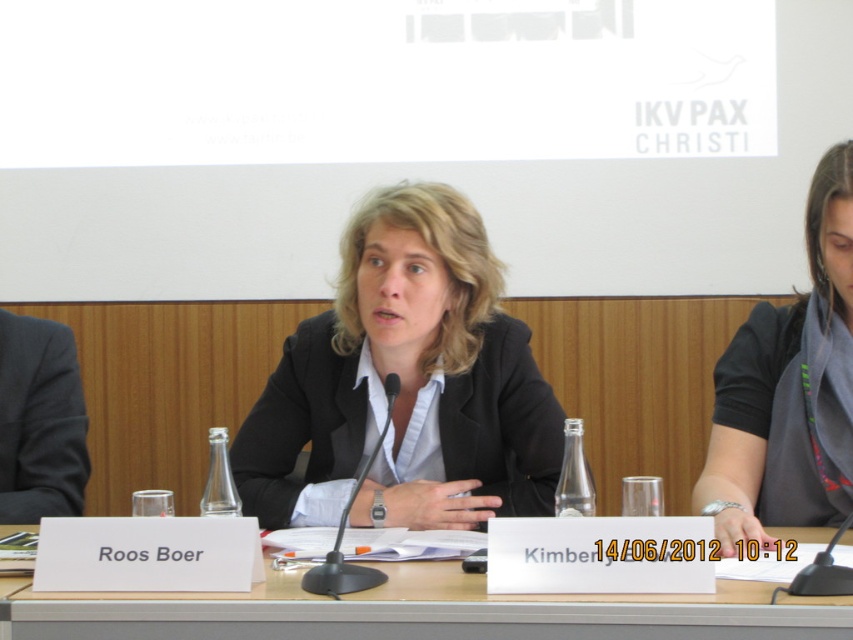
Based on the scene description, can you determine which object is taller between the black matte blazer at center and the wooden table at center?

The black matte blazer at center is taller than the wooden table at center according to the description.

You are attending a conference and notice the wooden table at center and the black fabric shirt at center. Which object is located lower in the image?

The wooden table at center is positioned under the black fabric shirt at center, so the wooden table at center is lower in the image.